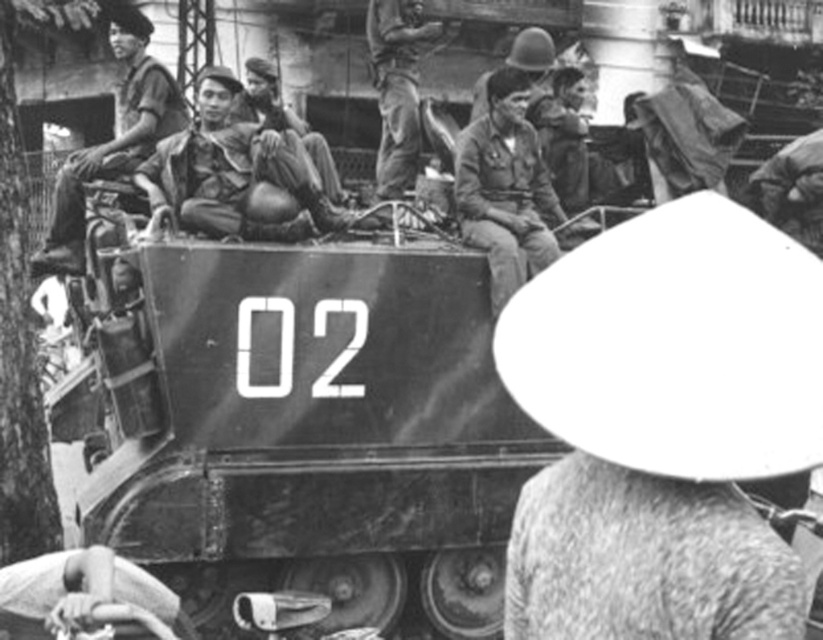
From the picture: You are an observer looking at the historical scene. You notice the matte khaki uniform at upper left and the matte khaki pants at center. Which clothing item is located lower in the image?

The matte khaki uniform at upper left is positioned under the matte khaki pants at center, meaning the uniform is lower in the image.

You are an observer looking at the soldiers on the military vehicle. Which soldier is shorter between the one wearing the camouflage fabric uniform at center and the one in the matte khaki uniform at upper left?

The camouflage fabric uniform at center is shorter than the matte khaki uniform at upper left.

You are a military inspector tasked with ensuring uniform compliance. You observe two soldiers in the scene wearing the camouflage fabric uniform at center and the matte khaki uniform at upper left. Which soldier is wearing a uniform that takes up more space in the image?

The matte khaki uniform at upper left takes up more space in the image than the camouflage fabric uniform at center.